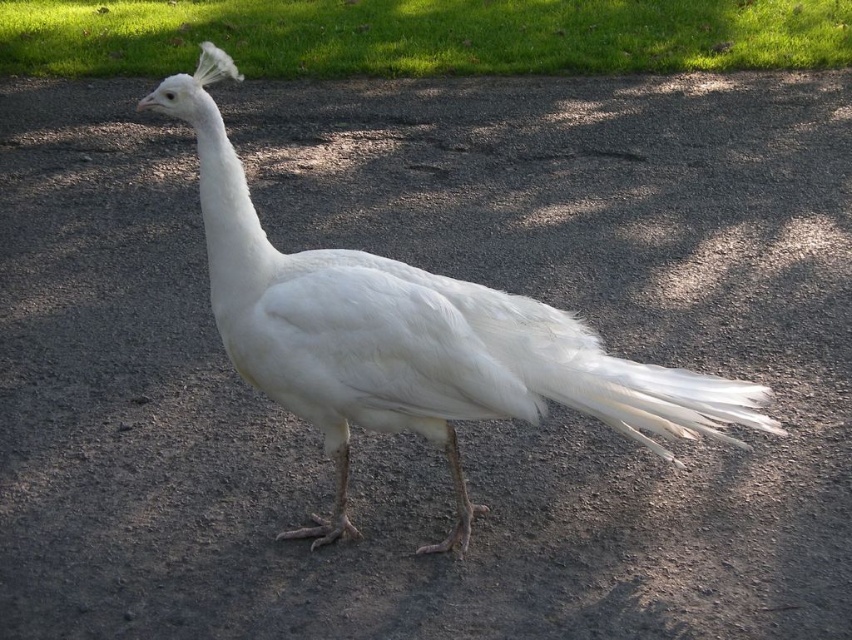
Question: Which of the following is the farthest from the observer?

Choices:
 (A) (609, 58)
 (B) (246, 298)
 (C) (614, 397)

Answer: (A)

Question: Is white feathered peacock at center positioned in front of green grass at upper center?

Choices:
 (A) no
 (B) yes

Answer: (B)

Question: Is green grass at upper center thinner than white feathered tail at right?

Choices:
 (A) yes
 (B) no

Answer: (B)

Question: Can you confirm if green grass at upper center is thinner than white feathered tail at right?

Choices:
 (A) no
 (B) yes

Answer: (A)

Question: Among these points, which one is nearest to the camera?

Choices:
 (A) (295, 1)
 (B) (367, 371)

Answer: (B)

Question: Estimate the real-world distances between objects in this image. Which object is farther from the white feathered tail at right?

Choices:
 (A) white feathered peacock at center
 (B) green grass at upper center

Answer: (B)